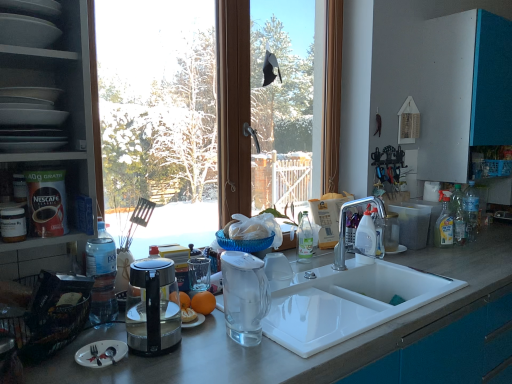
In order to face matte white plates at left, positioned as the 1th shelf in bottom-to-top order, should I rotate leftwards or rightwards?

You should look left and rotate roughly 28.279 degrees.

What do you see at coordinates (211, 104) in the screenshot? I see `transparent glass window at center` at bounding box center [211, 104].

What is the approximate height of matte gray plates at upper left, which is the 1th shelf from top to bottom?

matte gray plates at upper left, which is the 1th shelf from top to bottom, is 12.14 centimeters in height.

The height and width of the screenshot is (384, 512). Describe the element at coordinates (31, 27) in the screenshot. I see `matte gray plates at upper left, arranged as the 2th shelf when ordered from the bottom` at that location.

The image size is (512, 384). I want to click on transparent glass blender at sink, so point(244,296).

What do you see at coordinates (346, 301) in the screenshot? I see `white ceramic sink at lower center` at bounding box center [346, 301].

Locate an element on the screen. This screenshot has width=512, height=384. smooth gray countertop at center is located at coordinates (288, 350).

Is silver matte fork at lower left far from clear plastic bottle at right, the 1th bottle from the right?

That's right, there is a large distance between silver matte fork at lower left and clear plastic bottle at right, the 1th bottle from the right.

Does point (95, 356) appear closer or farther from the camera than point (473, 229)?

Clearly, point (95, 356) is closer to the camera than point (473, 229).

Is silver matte fork at lower left further to camera compared to clear plastic bottle at right, the 1th bottle from the right?

No, it is in front of clear plastic bottle at right, the 1th bottle from the right.

Which of these two, silver matte fork at lower left or clear plastic bottle at right, which is counted as the 2th bottle, starting from the left, is thinner?

Thinner between the two is silver matte fork at lower left.

Between smooth gray countertop at center and white ceramic sink at lower center, which one has larger width?

smooth gray countertop at center is wider.

Which is in front, point (312, 378) or point (400, 272)?

The point (312, 378) is closer to the camera.

From the picture: Does smooth gray countertop at center come in front of white ceramic sink at lower center?

Yes, it is in front of white ceramic sink at lower center.

Where is `sink above the smooth gray countertop at center (from the image's perspective)`? This screenshot has width=512, height=384. sink above the smooth gray countertop at center (from the image's perspective) is located at coordinates (346, 301).

Is white ceramic sink at lower center beside matte white plates at left, positioned as the 1th shelf in bottom-to-top order?

No, white ceramic sink at lower center is not in contact with matte white plates at left, positioned as the 1th shelf in bottom-to-top order.

From a real-world perspective, who is located lower, white ceramic sink at lower center or matte white plates at left, the second shelf in the top-to-bottom sequence?

From a 3D spatial view, white ceramic sink at lower center is below.

From the picture: Considering the positions of objects white ceramic sink at lower center and matte white plates at left, positioned as the 1th shelf in bottom-to-top order, in the image provided, who is more to the right, white ceramic sink at lower center or matte white plates at left, positioned as the 1th shelf in bottom-to-top order,?

From the viewer's perspective, white ceramic sink at lower center appears more on the right side.

Considering the relative positions of matte white plates at left, positioned as the 1th shelf in bottom-to-top order, and silver metallic faucet at sink right in the image provided, is matte white plates at left, positioned as the 1th shelf in bottom-to-top order, to the right of silver metallic faucet at sink right from the viewer's perspective?

In fact, matte white plates at left, positioned as the 1th shelf in bottom-to-top order, is to the left of silver metallic faucet at sink right.

From a real-world perspective, is matte white plates at left, the second shelf in the top-to-bottom sequence, on top of silver metallic faucet at sink right?

Yes.

Can you tell me how much matte white plates at left, the second shelf in the top-to-bottom sequence, and silver metallic faucet at sink right differ in facing direction?

The angle between the facing direction of matte white plates at left, the second shelf in the top-to-bottom sequence, and the facing direction of silver metallic faucet at sink right is 0.822 degrees.

Which of these two, matte white plates at left, the second shelf in the top-to-bottom sequence, or silver metallic faucet at sink right, is thinner?

matte white plates at left, the second shelf in the top-to-bottom sequence.

In order to click on the 1st bottle behind the matte gray plates at upper left, which is the 1th shelf from top to bottom, counting from the anchor's position in this screenshot , I will do `click(365, 239)`.

From the image's perspective, does white plastic bottle at sink right, the 1th bottle in the front-to-back sequence, appear higher than matte gray plates at upper left, which is the 1th shelf from top to bottom?

No, from the image's perspective, white plastic bottle at sink right, the 1th bottle in the front-to-back sequence, is not over matte gray plates at upper left, which is the 1th shelf from top to bottom.

Is point (360, 256) closer or farther from the camera than point (23, 12)?

Point (360, 256) is positioned farther from the camera compared to point (23, 12).

Based on the photo, from the image's perspective, which one is positioned lower, matte gray plates at upper left, arranged as the 2th shelf when ordered from the bottom, or transparent glass window at center?

transparent glass window at center appears lower in the image.

Considering the sizes of objects matte gray plates at upper left, which is the 1th shelf from top to bottom, and transparent glass window at center in the image provided, who is taller, matte gray plates at upper left, which is the 1th shelf from top to bottom, or transparent glass window at center?

transparent glass window at center.

Between matte gray plates at upper left, arranged as the 2th shelf when ordered from the bottom, and transparent glass window at center, which one has smaller size?

Smaller between the two is matte gray plates at upper left, arranged as the 2th shelf when ordered from the bottom.

You are a GUI agent. You are given a task and a screenshot of the screen. Output one action in this format:
    pyautogui.click(x=<x>, y=<y>)
    Task: Click on the shelf that is above the transparent glass window at center (from the image's perspective)
    
    Given the screenshot: What is the action you would take?
    pyautogui.click(x=31, y=27)

Find the location of a particular element. The width and height of the screenshot is (512, 384). the 1st bottle located beneath the matte white plates at left, positioned as the 1th shelf in bottom-to-top order (from a real-world perspective) is located at coordinates (471, 210).

Would you say clear plastic bottle at right, which is counted as the 2th bottle, starting from the left, contains matte white plates at left, positioned as the 1th shelf in bottom-to-top order?

Definitely not — matte white plates at left, positioned as the 1th shelf in bottom-to-top order, is not inside clear plastic bottle at right, which is counted as the 2th bottle, starting from the left.

Considering the sizes of objects clear plastic bottle at right, which is counted as the 2th bottle, starting from the left, and matte white plates at left, positioned as the 1th shelf in bottom-to-top order, in the image provided, who is smaller, clear plastic bottle at right, which is counted as the 2th bottle, starting from the left, or matte white plates at left, positioned as the 1th shelf in bottom-to-top order,?

Smaller between the two is clear plastic bottle at right, which is counted as the 2th bottle, starting from the left.

Looking at this image, which of these two, clear plastic bottle at right, which is counted as the 2th bottle, starting from the left, or matte white plates at left, the second shelf in the top-to-bottom sequence, is wider?

Wider between the two is matte white plates at left, the second shelf in the top-to-bottom sequence.

From a real-world perspective, which bottle is the 2nd one above the silver matte fork at lower left? Please provide its 2D coordinates.

[(471, 210)]

What are the coordinates of `countertop below the white ceramic sink at lower center (from a real-world perspective)` in the screenshot? It's located at (288, 350).

Considering their positions, is smooth gray countertop at center positioned closer to clear plastic bottle at right, which is counted as the 2th bottle, starting from the front, than matte white plates at left, the second shelf in the top-to-bottom sequence?

Among the two, smooth gray countertop at center is located nearer to clear plastic bottle at right, which is counted as the 2th bottle, starting from the front.

Considering their positions, is transparent glass blender at sink positioned further to silver metallic faucet at sink right than transparent glass window at center?

transparent glass window at center.

In the scene shown: Estimate the real-world distances between objects in this image. Which object is further from clear plastic bottle at right, which is counted as the 2th bottle, starting from the front, silver metallic faucet at sink right or matte white plates at left, the second shelf in the top-to-bottom sequence?

matte white plates at left, the second shelf in the top-to-bottom sequence, lies further to clear plastic bottle at right, which is counted as the 2th bottle, starting from the front, than the other object.

Considering their positions, is silver matte fork at lower left positioned closer to silver metallic faucet at sink right than yellow liquid bottle at right?

yellow liquid bottle at right is positioned closer to the anchor silver metallic faucet at sink right.

Looking at the image, which one is located closer to clear plastic bottle at right, which is counted as the 2th bottle, starting from the front, silver metallic faucet at sink right or white plastic bottle at sink right, the 1th bottle in the front-to-back sequence?

Based on the image, silver metallic faucet at sink right appears to be nearer to clear plastic bottle at right, which is counted as the 2th bottle, starting from the front.

From the image, which object appears to be nearer to white plastic bottle at sink right, which is the second bottle in right-to-left order, transparent glass blender at sink or silver metallic faucet at sink right?

silver metallic faucet at sink right lies closer to white plastic bottle at sink right, which is the second bottle in right-to-left order, than the other object.

When comparing their distances from transparent glass blender at sink, does smooth gray countertop at center or yellow liquid bottle at right seem further?

yellow liquid bottle at right is further to transparent glass blender at sink.

Estimate the real-world distances between objects in this image. Which object is closer to orange matte at center, clear plastic bottle at right, which is counted as the 2th bottle, starting from the left, or silver metallic faucet at sink right?

Based on the image, silver metallic faucet at sink right appears to be nearer to orange matte at center.

Where is `bottle between silver metallic faucet at sink right and clear plastic bottle at right, which is counted as the 2th bottle, starting from the left, from left to right`? The image size is (512, 384). bottle between silver metallic faucet at sink right and clear plastic bottle at right, which is counted as the 2th bottle, starting from the left, from left to right is located at coordinates (365, 239).

Where is `cleaning product between silver metallic faucet at sink right and clear plastic bottle at right, which is counted as the 2th bottle, starting from the front, from left to right`? Image resolution: width=512 pixels, height=384 pixels. cleaning product between silver metallic faucet at sink right and clear plastic bottle at right, which is counted as the 2th bottle, starting from the front, from left to right is located at coordinates (444, 224).

Where is `blender located between matte gray plates at upper left, which is the 1th shelf from top to bottom, and clear plastic bottle at right, the 1th bottle viewed from the back, in the left-right direction`? The image size is (512, 384). blender located between matte gray plates at upper left, which is the 1th shelf from top to bottom, and clear plastic bottle at right, the 1th bottle viewed from the back, in the left-right direction is located at coordinates (244, 296).

Where is `tap positioned between white ceramic sink at lower center and clear plastic bottle at right, which is counted as the 2th bottle, starting from the front, from near to far`? tap positioned between white ceramic sink at lower center and clear plastic bottle at right, which is counted as the 2th bottle, starting from the front, from near to far is located at coordinates (345, 224).